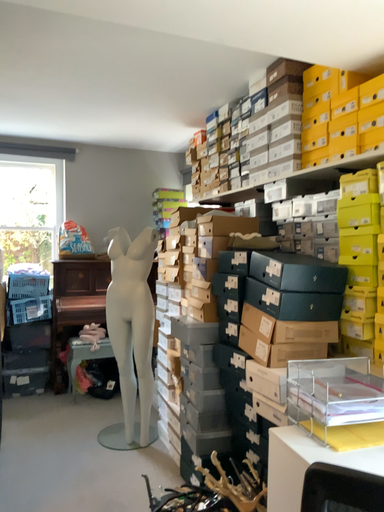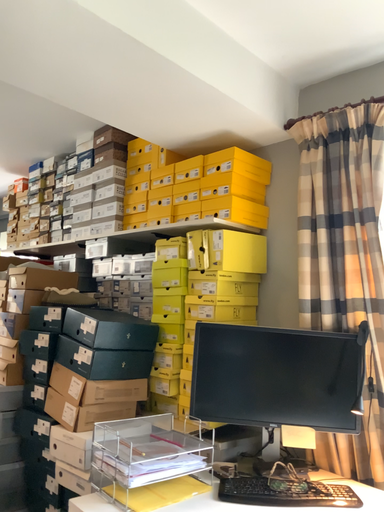
Question: How did the camera likely rotate when shooting the video?

Choices:
 (A) rotated upward
 (B) rotated downward

Answer: (A)